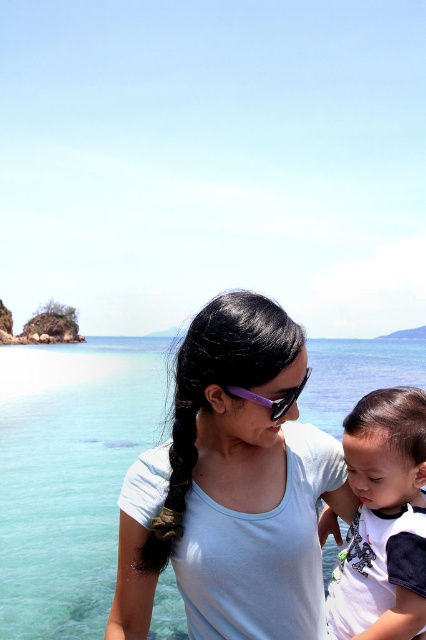
Can you confirm if white cotton shirt at lower right is positioned below purple plastic goggles at center?

Correct, white cotton shirt at lower right is located below purple plastic goggles at center.

Between white cotton shirt at lower right and purple plastic goggles at center, which one is positioned higher?

Positioned higher is purple plastic goggles at center.

Where is `white cotton shirt at lower right`? This screenshot has height=640, width=426. white cotton shirt at lower right is located at coordinates (383, 518).

Find the location of `white cotton shirt at lower right`. white cotton shirt at lower right is located at coordinates (383, 518).

Is clear blue water at center bigger than purple plastic goggles at center?

Yes, clear blue water at center is bigger than purple plastic goggles at center.

Who is more forward, [60,554] or [249,392]?

Point [249,392]

Where is `clear blue water at center`? clear blue water at center is located at coordinates (69, 476).

Does clear blue water at center appear on the left side of white cotton shirt at lower right?

Yes, clear blue water at center is to the left of white cotton shirt at lower right.

Does point (40, 465) come in front of point (417, 477)?

No, (40, 465) is further to viewer.

Where is `clear blue water at center`? clear blue water at center is located at coordinates (x=69, y=476).